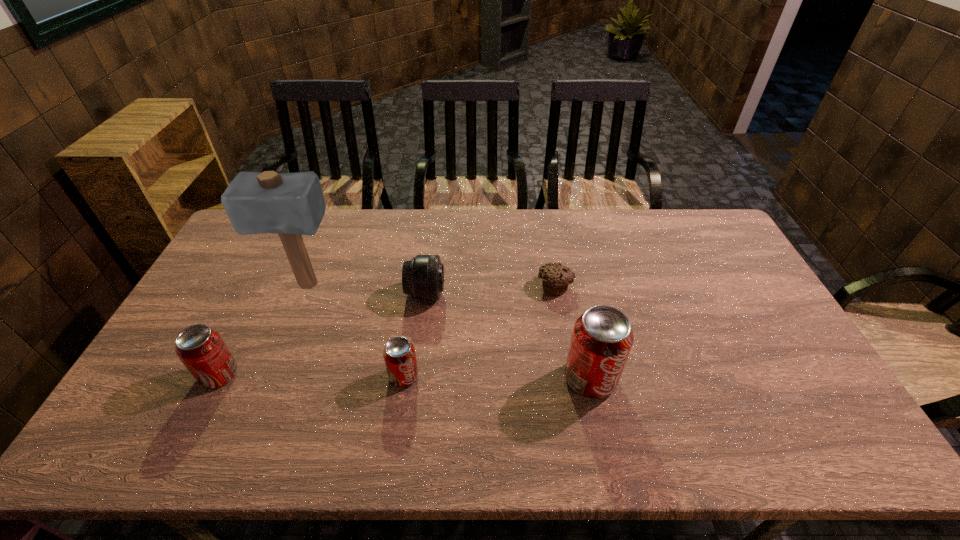
The image size is (960, 540). In order to click on vacant space located on the front-facing side of the telephoto lens in this screenshot , I will do `click(564, 294)`.

Image resolution: width=960 pixels, height=540 pixels. I want to click on free space located 0.360m on the right of the mallet, so click(x=453, y=285).

Locate an element on the screen. This screenshot has width=960, height=540. free space located on the back of the shortest object is located at coordinates (543, 216).

Where is `object present at the left edge`? object present at the left edge is located at coordinates (200, 348).

Locate an element on the screen. object that is at the near left corner is located at coordinates (200, 348).

The height and width of the screenshot is (540, 960). I want to click on vacant area at the far edge, so click(377, 222).

Where is `free region at the near edge of the desktop`? The width and height of the screenshot is (960, 540). free region at the near edge of the desktop is located at coordinates (693, 396).

At what (x,y) coordinates should I click in order to perform the action: click on free space at the left edge of the desktop. Please return your answer as a coordinate pair (x, y). This screenshot has height=540, width=960. Looking at the image, I should click on (249, 284).

In the image, there is a desktop. Where is `free space at the right edge`? The width and height of the screenshot is (960, 540). free space at the right edge is located at coordinates (760, 342).

Locate an element on the screen. The image size is (960, 540). free space at the far right corner of the desktop is located at coordinates (689, 243).